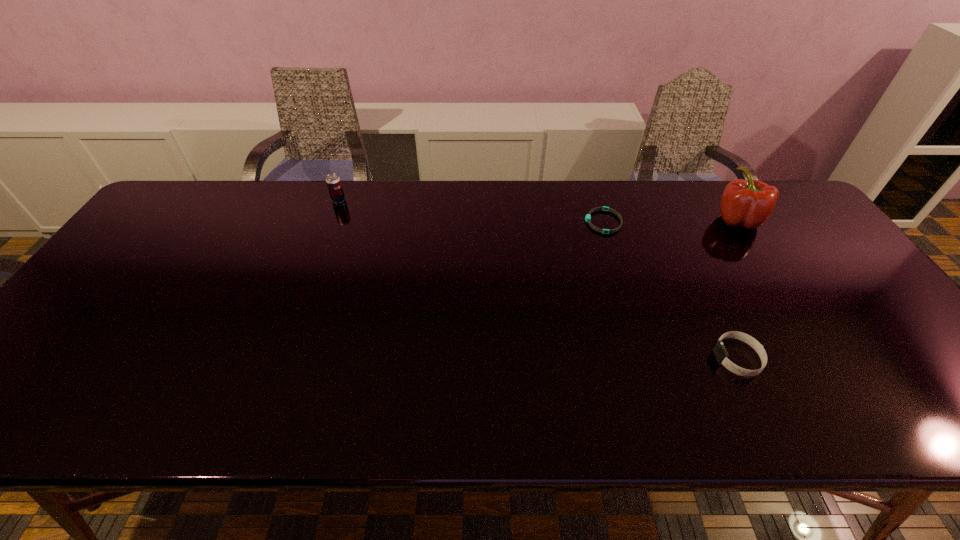
Where is `free spot that satisfies the following two spatial constraints: 1. on the front side of the rightmost object; 2. on the outer surface of the nearer wristband`? The height and width of the screenshot is (540, 960). free spot that satisfies the following two spatial constraints: 1. on the front side of the rightmost object; 2. on the outer surface of the nearer wristband is located at coordinates (827, 358).